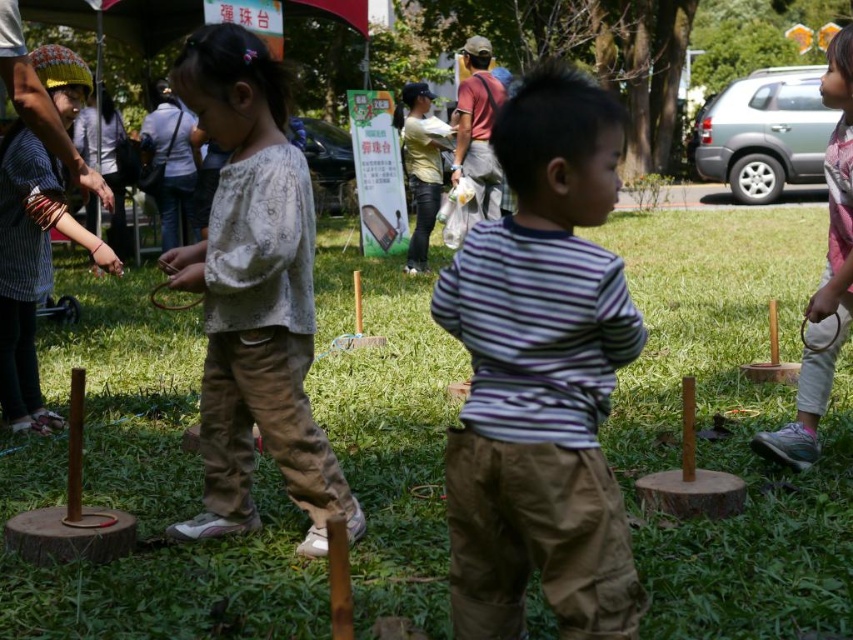
Between point (274, 381) and point (816, 412), which one is positioned in front?

Point (274, 381) is in front.

Who is shorter, light beige cotton shirt at center or pink fabric shirt at right?

With less height is light beige cotton shirt at center.

Who is more forward, (270, 424) or (846, 64)?

Positioned in front is point (270, 424).

Where is `light beige cotton shirt at center`? light beige cotton shirt at center is located at coordinates (253, 296).

Which is more to the left, green grass at center or striped cotton shirt at center?

From the viewer's perspective, green grass at center appears more on the left side.

Can you confirm if green grass at center is thinner than striped cotton shirt at center?

In fact, green grass at center might be wider than striped cotton shirt at center.

Who is more forward, (157, 426) or (457, 548)?

Positioned in front is point (457, 548).

Identify the location of green grass at center. (730, 426).

Can you confirm if green grass at center is positioned above light beige cotton shirt at center?

Actually, green grass at center is below light beige cotton shirt at center.

Is green grass at center thinner than light beige cotton shirt at center?

In fact, green grass at center might be wider than light beige cotton shirt at center.

What do you see at coordinates (730, 426) in the screenshot? The height and width of the screenshot is (640, 853). I see `green grass at center` at bounding box center [730, 426].

Find the location of a particular element. green grass at center is located at coordinates (730, 426).